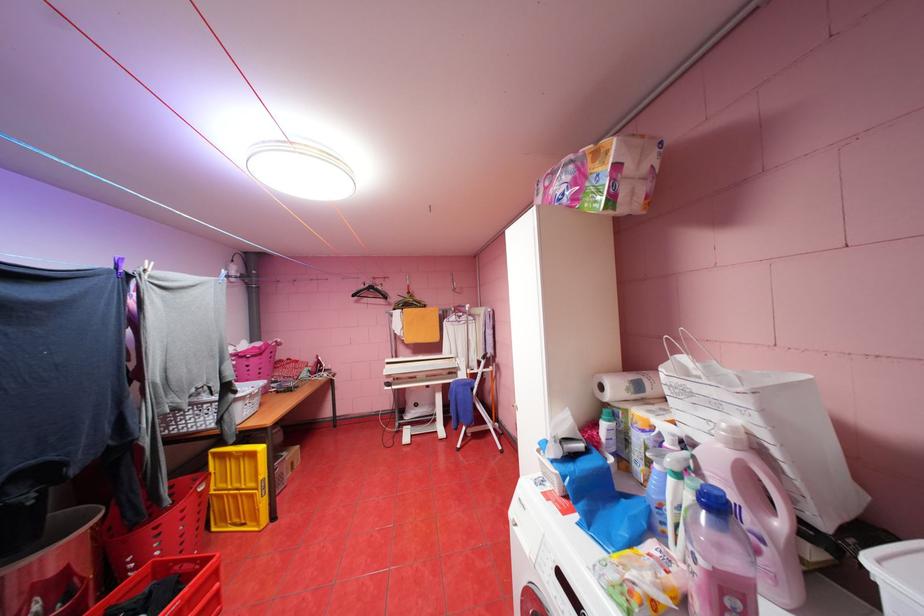
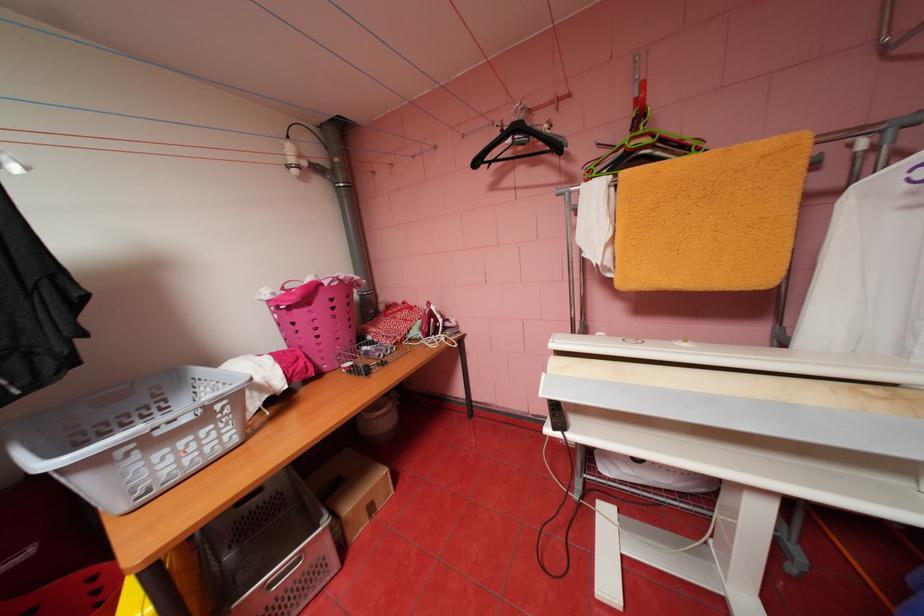
Question: I am providing you with two images of the same scene from different viewpoints. Please identify which objects are invisible in image2.

Choices:
 (A) grey laundry basket
 (B) white cabinet knob
 (C) black clothes hanger
 (D) ironing press handle

Answer: (D)